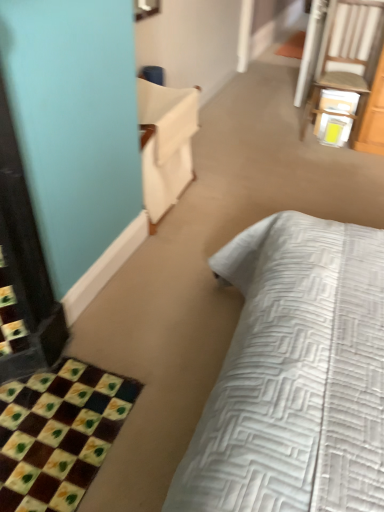
The image size is (384, 512). Identify the location of checkerboard fabric bath mat at lower left. tap(58, 434).

You are a GUI agent. You are given a task and a screenshot of the screen. Output one action in this format:
    pyautogui.click(x=<x>, y=<y>)
    Task: Click on the white fabric armchair at upper left
    The height and width of the screenshot is (512, 384).
    Given the screenshot: What is the action you would take?
    pyautogui.click(x=165, y=143)

Is white wood chair at upper right shorter than white fabric armchair at upper left?

In fact, white wood chair at upper right may be taller than white fabric armchair at upper left.

Where is `armchair lying below the white wood chair at upper right (from the image's perspective)`? Image resolution: width=384 pixels, height=512 pixels. armchair lying below the white wood chair at upper right (from the image's perspective) is located at coordinates [165, 143].

Which object is closer to the camera taking this photo, white wood chair at upper right or white fabric armchair at upper left?

white fabric armchair at upper left is closer to the camera.

From the image's perspective, is white wood chair at upper right located above or below white fabric armchair at upper left?

Based on their image positions, white wood chair at upper right is located above white fabric armchair at upper left.

What's the angular difference between checkerboard fabric bath mat at lower left and white fabric armchair at upper left's facing directions?

There is a 0.633-degree angle between the facing directions of checkerboard fabric bath mat at lower left and white fabric armchair at upper left.

Where is `bath mat located underneath the white fabric armchair at upper left (from a real-world perspective)`? This screenshot has width=384, height=512. bath mat located underneath the white fabric armchair at upper left (from a real-world perspective) is located at coordinates (58, 434).

Is white fabric armchair at upper left located within checkerboard fabric bath mat at lower left?

That's incorrect, white fabric armchair at upper left is not inside checkerboard fabric bath mat at lower left.

Does white fabric armchair at upper left lie behind checkerboard fabric bath mat at lower left?

Yes.

From the image's perspective, who appears lower, white fabric armchair at upper left or checkerboard fabric bath mat at lower left?

checkerboard fabric bath mat at lower left appears lower in the image.

Based on their sizes in the image, would you say white fabric armchair at upper left is bigger or smaller than checkerboard fabric bath mat at lower left?

In the image, white fabric armchair at upper left appears to be larger than checkerboard fabric bath mat at lower left.

Can you confirm if white fabric armchair at upper left is taller than checkerboard fabric bath mat at lower left?

Indeed, white fabric armchair at upper left has a greater height compared to checkerboard fabric bath mat at lower left.

Does point (164, 90) come in front of point (363, 88)?

Yes.

Looking at this image, in terms of height, does white fabric armchair at upper left look taller or shorter compared to white wood chair at upper right?

Considering their sizes, white fabric armchair at upper left has less height than white wood chair at upper right.

From the image's perspective, is white fabric armchair at upper left on white wood chair at upper right?

No.

Can you confirm if white fabric armchair at upper left is positioned to the right of white wood chair at upper right?

Incorrect, white fabric armchair at upper left is not on the right side of white wood chair at upper right.

Is white wood chair at upper right touching checkerboard fabric bath mat at lower left?

No, white wood chair at upper right is not beside checkerboard fabric bath mat at lower left.

What's the angular difference between white wood chair at upper right and checkerboard fabric bath mat at lower left's facing directions?

The angle between the facing direction of white wood chair at upper right and the facing direction of checkerboard fabric bath mat at lower left is 89 degrees.

Considering the positions of points (374, 19) and (40, 502), is point (374, 19) closer to camera compared to point (40, 502)?

That is False.

Considering the relative sizes of white wood chair at upper right and checkerboard fabric bath mat at lower left in the image provided, is white wood chair at upper right thinner than checkerboard fabric bath mat at lower left?

Yes, white wood chair at upper right is thinner than checkerboard fabric bath mat at lower left.

Where is `bath mat below the white wood chair at upper right (from the image's perspective)`? bath mat below the white wood chair at upper right (from the image's perspective) is located at coordinates (58, 434).

Is checkerboard fabric bath mat at lower left bigger or smaller than white wood chair at upper right?

In the image, checkerboard fabric bath mat at lower left appears to be smaller than white wood chair at upper right.

From the image's perspective, is checkerboard fabric bath mat at lower left on white wood chair at upper right?

Actually, checkerboard fabric bath mat at lower left appears below white wood chair at upper right in the image.

This screenshot has width=384, height=512. In the image, there is a white fabric armchair at upper left. Find the location of `chair above it (from the image's perspective)`. chair above it (from the image's perspective) is located at coordinates (347, 55).

The height and width of the screenshot is (512, 384). I want to click on armchair above the checkerboard fabric bath mat at lower left (from a real-world perspective), so click(165, 143).

Estimate the real-world distances between objects in this image. Which object is closer to checkerboard fabric bath mat at lower left, white wood chair at upper right or white fabric armchair at upper left?

white fabric armchair at upper left.

Based on their spatial positions, is checkerboard fabric bath mat at lower left or white wood chair at upper right further from white fabric armchair at upper left?

white wood chair at upper right.

Based on their spatial positions, is white wood chair at upper right or checkerboard fabric bath mat at lower left further from white fabric armchair at upper left?

Based on the image, white wood chair at upper right appears to be further to white fabric armchair at upper left.

Looking at the image, which one is located further to checkerboard fabric bath mat at lower left, white fabric armchair at upper left or white wood chair at upper right?

Among the two, white wood chair at upper right is located further to checkerboard fabric bath mat at lower left.

From the image, which object appears to be nearer to white wood chair at upper right, white fabric armchair at upper left or checkerboard fabric bath mat at lower left?

white fabric armchair at upper left.

Estimate the real-world distances between objects in this image. Which object is closer to white wood chair at upper right, checkerboard fabric bath mat at lower left or white fabric armchair at upper left?

white fabric armchair at upper left is positioned closer to the anchor white wood chair at upper right.

Locate an element on the screen. The height and width of the screenshot is (512, 384). armchair that lies between white wood chair at upper right and checkerboard fabric bath mat at lower left from top to bottom is located at coordinates (165, 143).